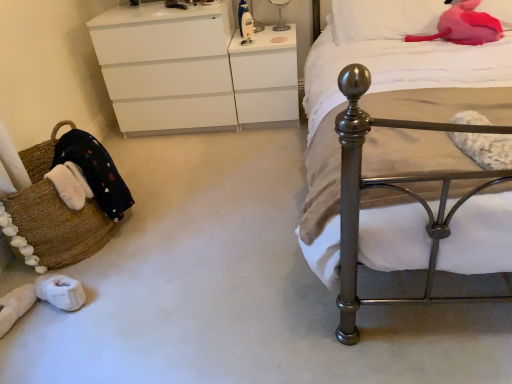
Question: Is polished metal bed at right at the left side of white glossy changing table at upper center?

Choices:
 (A) yes
 (B) no

Answer: (B)

Question: From the image's perspective, is polished metal bed at right located above white glossy changing table at upper center?

Choices:
 (A) no
 (B) yes

Answer: (A)

Question: Would you say white glossy changing table at upper center is part of polished metal bed at right's contents?

Choices:
 (A) yes
 (B) no

Answer: (B)

Question: From a real-world perspective, is polished metal bed at right on white glossy changing table at upper center?

Choices:
 (A) yes
 (B) no

Answer: (A)

Question: Is polished metal bed at right wider than white glossy changing table at upper center?

Choices:
 (A) no
 (B) yes

Answer: (B)

Question: Considering the positions of brown woven basket at lower left and pink plush at upper right, placed as the second pillow when sorted from right to left, in the image, is brown woven basket at lower left bigger or smaller than pink plush at upper right, placed as the second pillow when sorted from right to left,?

Choices:
 (A) big
 (B) small

Answer: (A)

Question: From a real-world perspective, is brown woven basket at lower left above or below pink plush at upper right, placed as the second pillow when sorted from right to left?

Choices:
 (A) below
 (B) above

Answer: (A)

Question: Considering the relative positions of brown woven basket at lower left and pink plush at upper right, positioned as the 1th pillow in left-to-right order, in the image provided, is brown woven basket at lower left to the left or to the right of pink plush at upper right, positioned as the 1th pillow in left-to-right order,?

Choices:
 (A) left
 (B) right

Answer: (A)

Question: Is point (74, 226) closer or farther from the camera than point (397, 28)?

Choices:
 (A) closer
 (B) farther

Answer: (A)

Question: In terms of width, does pink plush at upper right, positioned as the 1th pillow in left-to-right order, look wider or thinner when compared to polished metal bed at right?

Choices:
 (A) wide
 (B) thin

Answer: (B)

Question: Is pink plush at upper right, positioned as the 1th pillow in left-to-right order, to the left or to the right of polished metal bed at right in the image?

Choices:
 (A) left
 (B) right

Answer: (A)

Question: From the image's perspective, is pink plush at upper right, positioned as the 1th pillow in left-to-right order, above or below polished metal bed at right?

Choices:
 (A) above
 (B) below

Answer: (A)

Question: Considering the positions of pink plush at upper right, placed as the second pillow when sorted from right to left, and polished metal bed at right in the image, is pink plush at upper right, placed as the second pillow when sorted from right to left, bigger or smaller than polished metal bed at right?

Choices:
 (A) big
 (B) small

Answer: (B)

Question: From their relative heights in the image, would you say polished metal bed at right is taller or shorter than transparent glass lamp at upper center?

Choices:
 (A) tall
 (B) short

Answer: (A)

Question: Considering the relative positions of polished metal bed at right and transparent glass lamp at upper center in the image provided, is polished metal bed at right to the left or to the right of transparent glass lamp at upper center?

Choices:
 (A) right
 (B) left

Answer: (A)